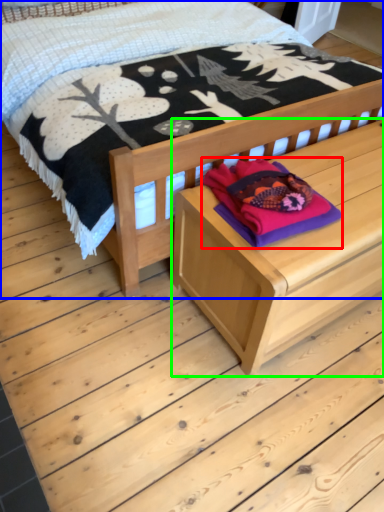
Question: Which object is positioned closest to clothing (highlighted by a red box)? Select from bed (highlighted by a blue box) and table (highlighted by a green box).

Choices:
 (A) bed
 (B) table

Answer: (B)